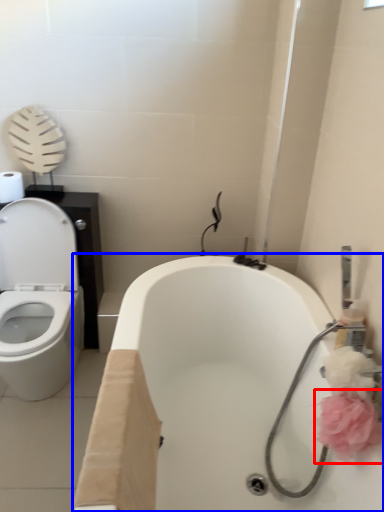
Question: Which object is further to the camera taking this photo, flower (highlighted by a red box) or bath (highlighted by a blue box)?

Choices:
 (A) flower
 (B) bath

Answer: (A)